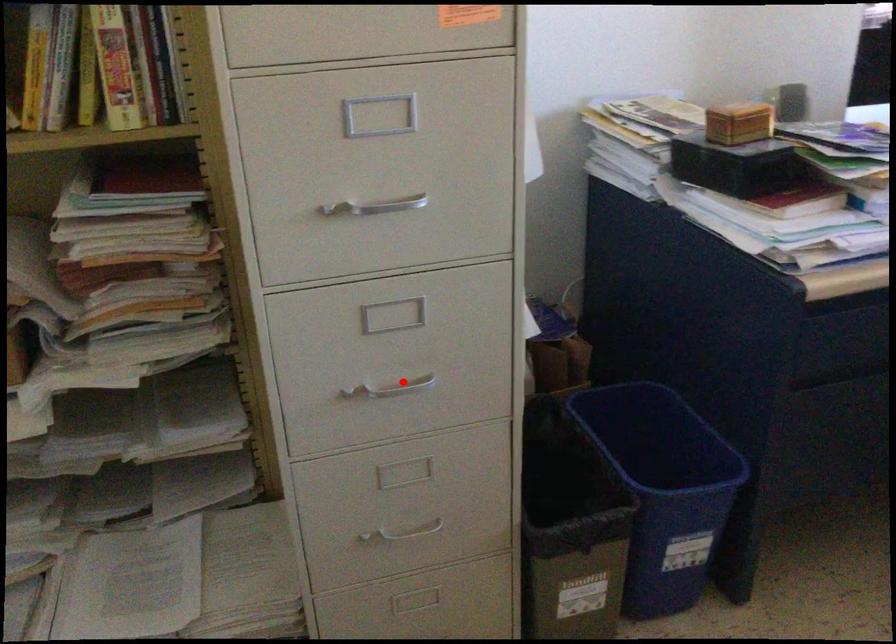
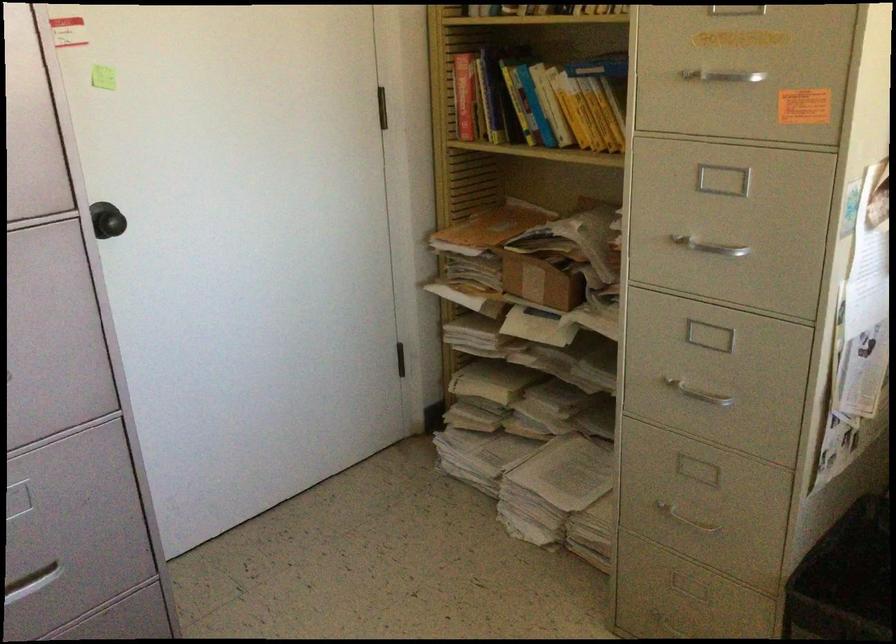
Question: I am providing you with two images of the same scene from different viewpoints. A red point is marked on the first image. Can you still see the location of the red point in image 2?

Choices:
 (A) Yes
 (B) No

Answer: (A)